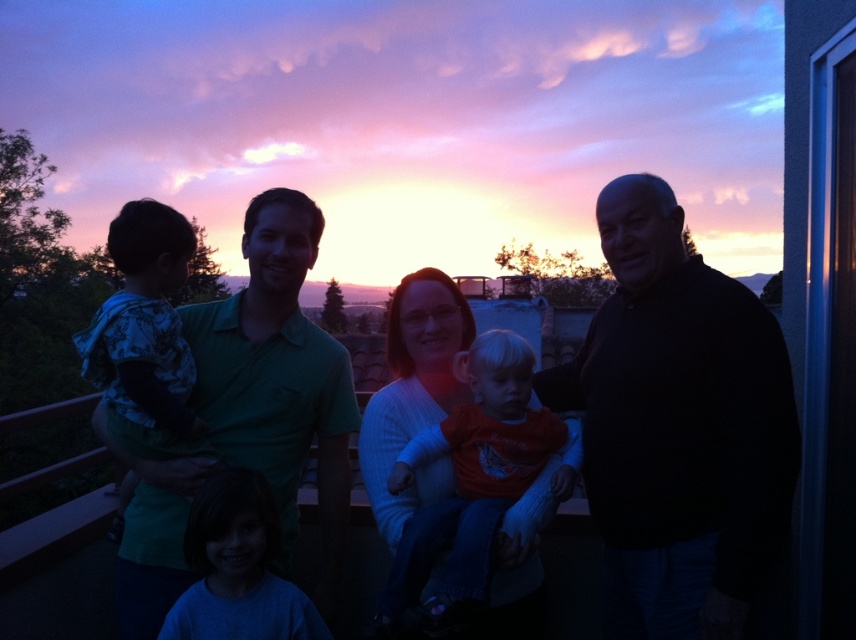
Who is lower down, green cotton shirt at left or camouflage fabric shirt at left?

green cotton shirt at left is lower down.

Which of these two, green cotton shirt at left or camouflage fabric shirt at left, stands taller?

With more height is green cotton shirt at left.

Image resolution: width=856 pixels, height=640 pixels. What do you see at coordinates (244, 417) in the screenshot?
I see `green cotton shirt at left` at bounding box center [244, 417].

Find the location of a particular element. The height and width of the screenshot is (640, 856). green cotton shirt at left is located at coordinates (244, 417).

Which is more to the right, matte green shirt at left or orange cotton shirt at center?

matte green shirt at left is more to the right.

Which is in front, point (681, 550) or point (574, 467)?

Point (681, 550) is more forward.

Does point (730, 602) lie behind point (563, 474)?

No.

The width and height of the screenshot is (856, 640). I want to click on matte green shirt at left, so click(x=758, y=396).

Is green cotton shirt at left closer to the viewer compared to blue cotton shirt at lower left?

No, it is behind blue cotton shirt at lower left.

Who is positioned more to the right, green cotton shirt at left or blue cotton shirt at lower left?

Positioned to the right is blue cotton shirt at lower left.

Describe the element at coordinates (244, 417) in the screenshot. The image size is (856, 640). I see `green cotton shirt at left` at that location.

Locate an element on the screen. This screenshot has width=856, height=640. green cotton shirt at left is located at coordinates (244, 417).